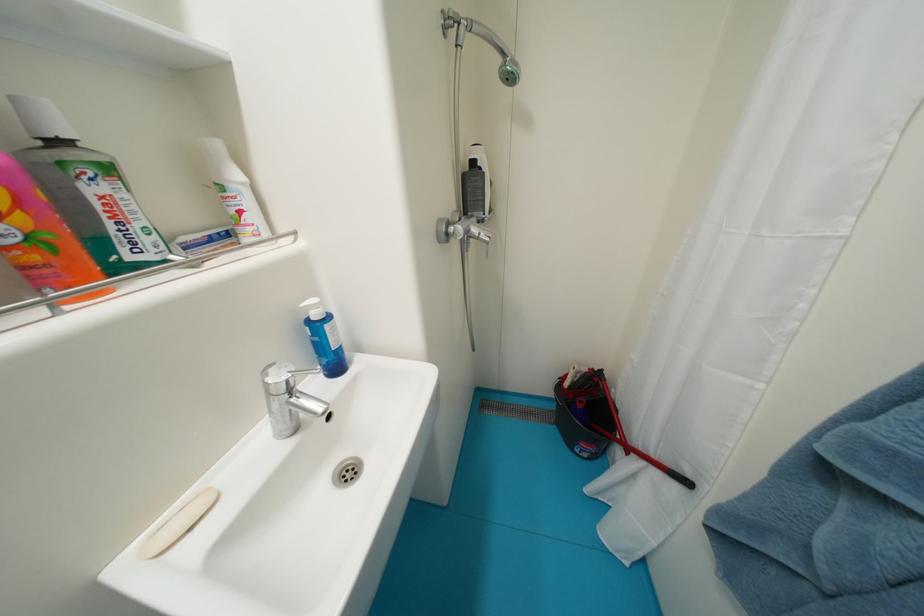
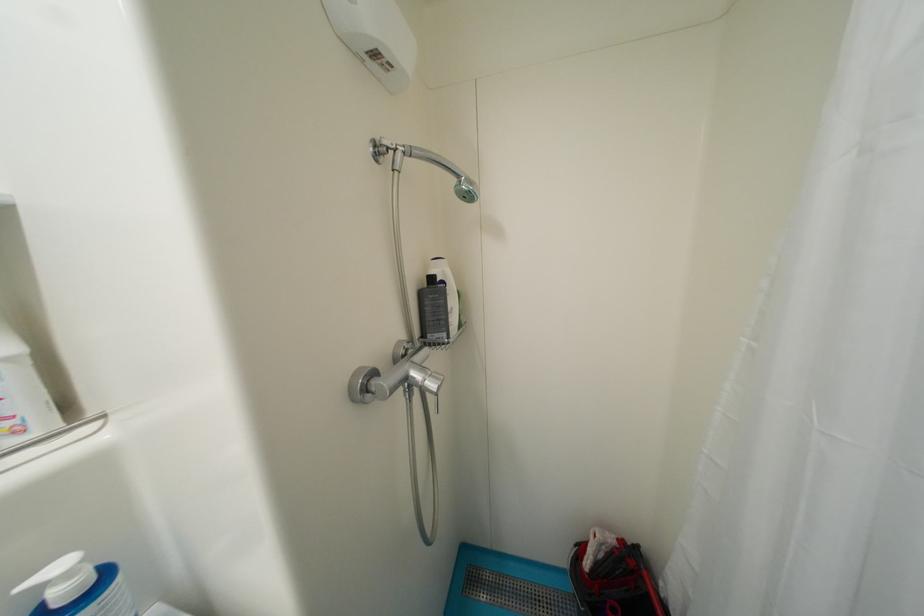
The point at (517, 81) is marked in the first image. Where is the corresponding point in the second image?

(476, 199)